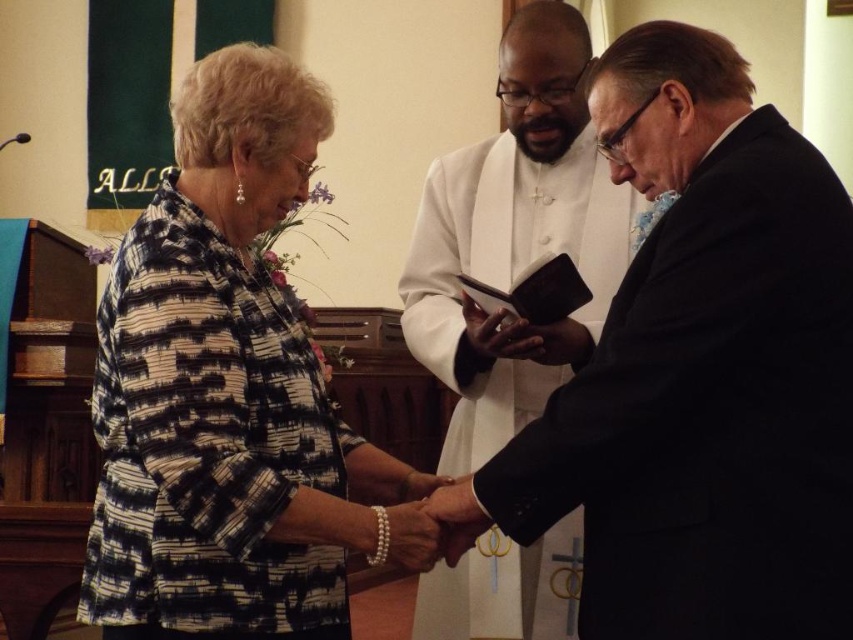
Question: In this image, where is black matte suit at center located relative to patterned fabric dress at left?

Choices:
 (A) left
 (B) right

Answer: (B)

Question: Does black matte suit at center appear on the left side of patterned fabric dress at left?

Choices:
 (A) no
 (B) yes

Answer: (A)

Question: Is black matte suit at center to the left of patterned fabric dress at left from the viewer's perspective?

Choices:
 (A) yes
 (B) no

Answer: (B)